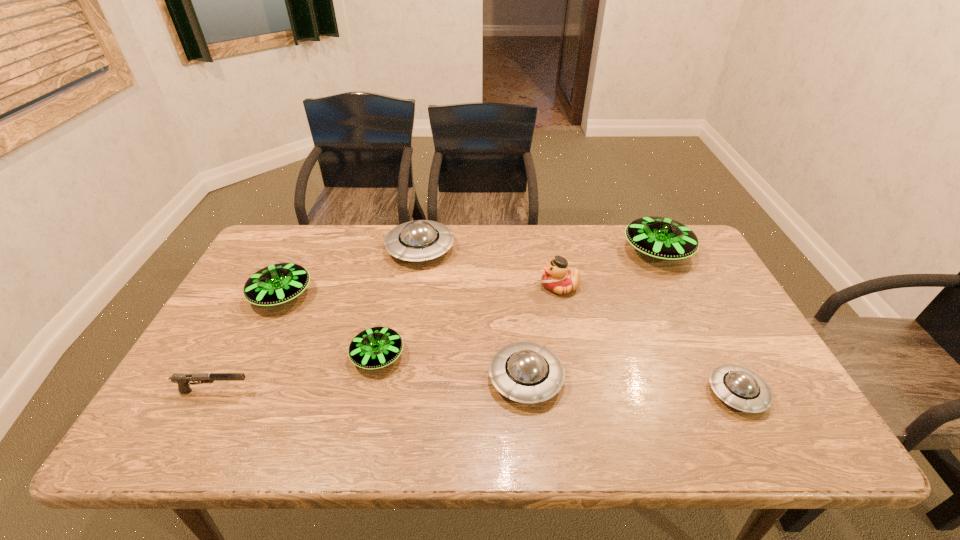
Locate an element on the screen. vacant space located 0.140m on the front of the second green saucer from right to left is located at coordinates (361, 431).

Find the location of a particular element. The height and width of the screenshot is (540, 960). free space located at the muzzle end of the gray gun is located at coordinates (396, 391).

The image size is (960, 540). I want to click on vacant space located 0.230m on the back of the smallest gray saucer, so 691,304.

At what (x,y) coordinates should I click in order to perform the action: click on object that is at the near edge. Please return your answer as a coordinate pair (x, y). The image size is (960, 540). Looking at the image, I should click on (741, 388).

Locate an element on the screen. saucer at the left edge is located at coordinates coord(276,284).

Where is `gun at the left edge`? This screenshot has height=540, width=960. gun at the left edge is located at coordinates (182, 379).

This screenshot has width=960, height=540. I want to click on object that is positioned at the far right corner, so click(x=661, y=238).

At what (x,y) coordinates should I click in order to perform the action: click on object that is positioned at the near right corner. Please return your answer as a coordinate pair (x, y). The image size is (960, 540). Looking at the image, I should click on (741, 388).

You are a GUI agent. You are given a task and a screenshot of the screen. Output one action in this format:
    pyautogui.click(x=<x>, y=<y>)
    Task: Click on the free space at the far edge of the desktop
    The height and width of the screenshot is (540, 960).
    Given the screenshot: What is the action you would take?
    pyautogui.click(x=361, y=250)

Locate an element on the screen. The image size is (960, 540). vacant point at the left edge is located at coordinates (246, 326).